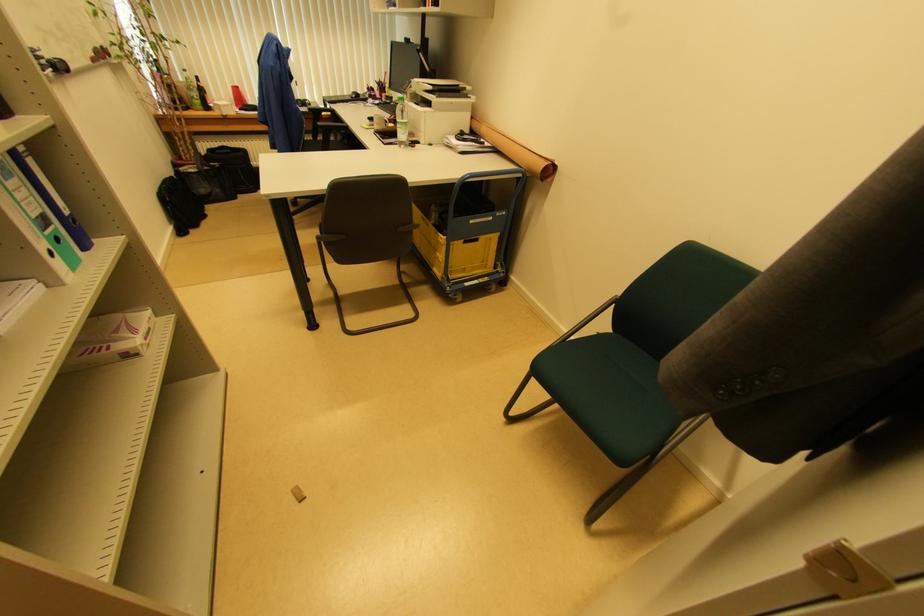
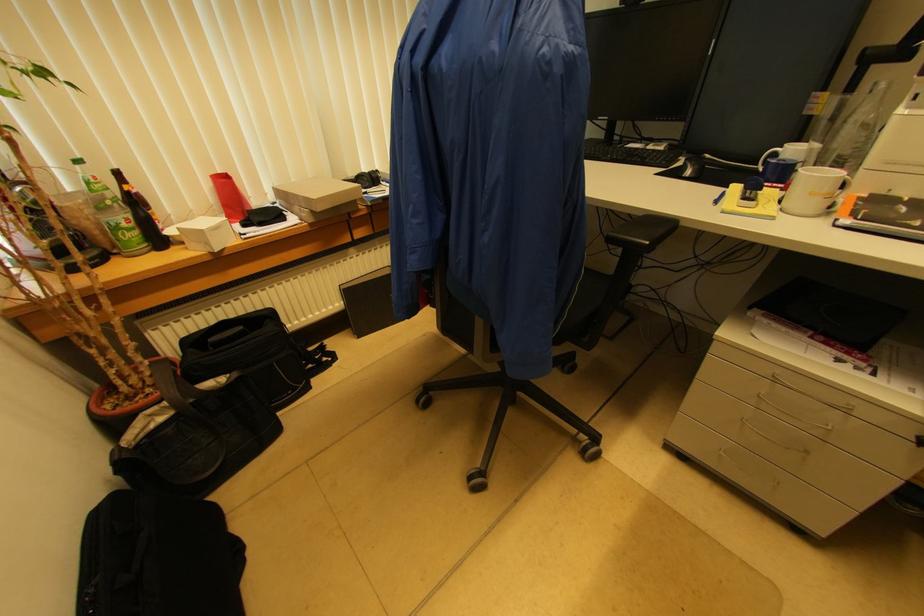
In the second image, find the point that corresponds to point 200,169 in the first image.

(175, 408)